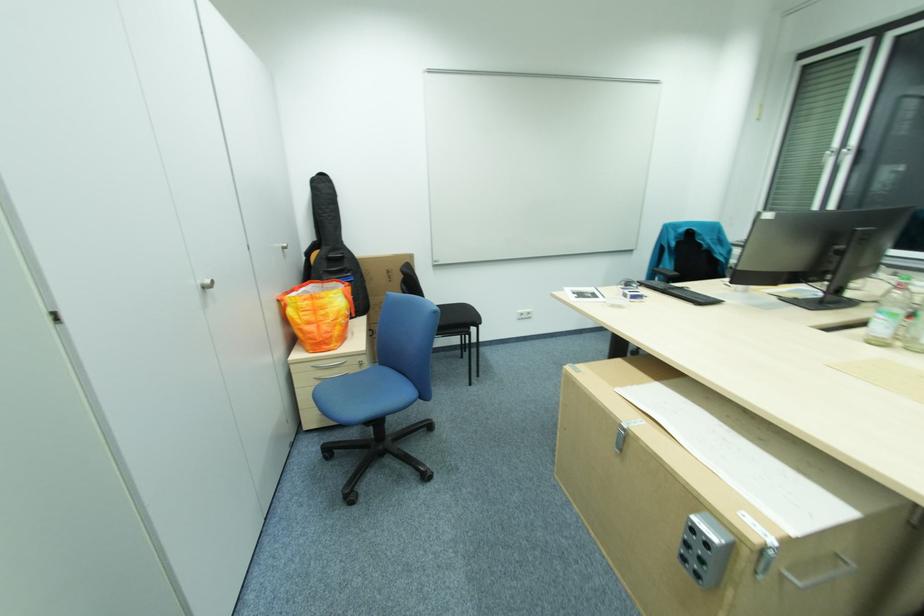
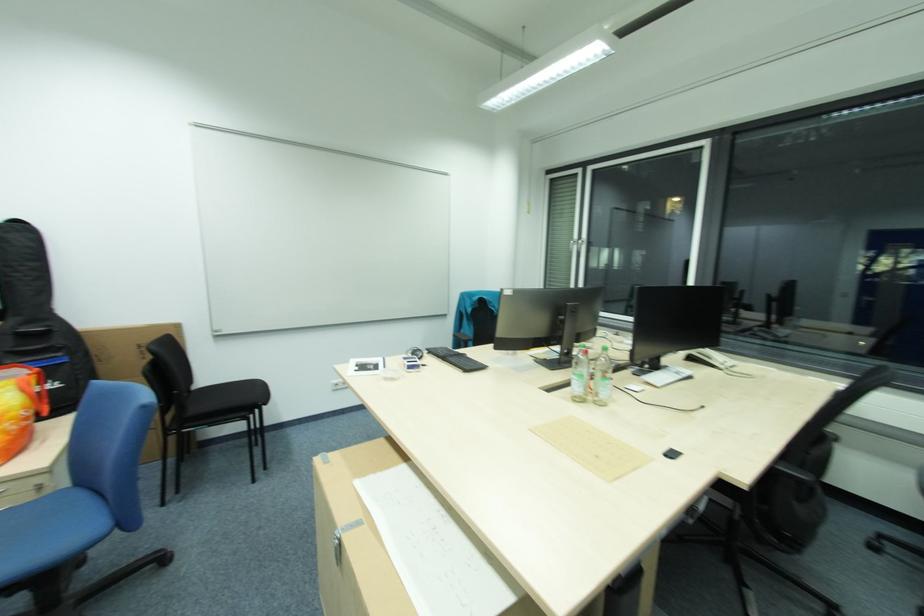
In the second image, find the point that corresponds to the point at 835,148 in the first image.

(580, 238)